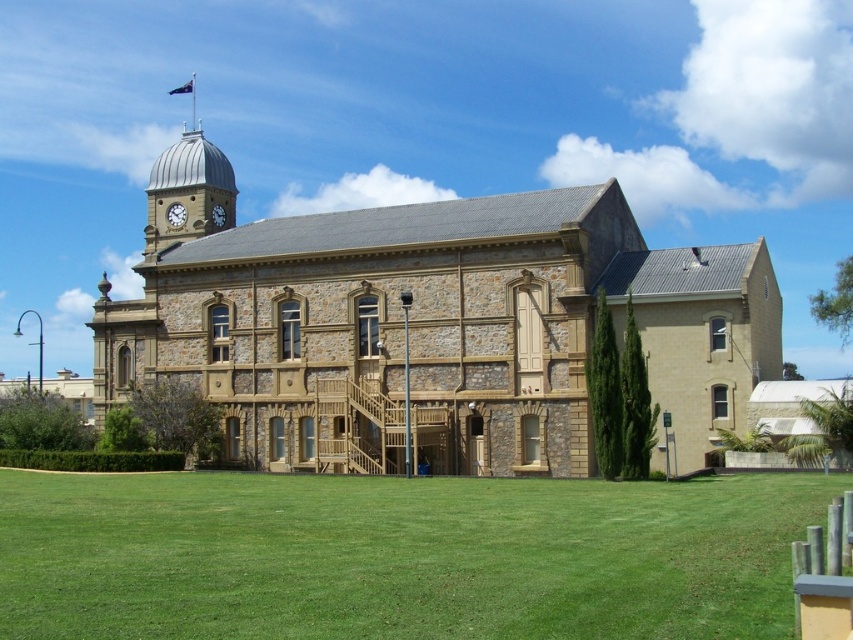
Between green grass at lower center and matte silver clock at upper left, which one is positioned higher?

matte silver clock at upper left is higher up.

Is point (54, 592) farther from viewer compared to point (178, 212)?

No, (54, 592) is in front of (178, 212).

Locate an element on the screen. green grass at lower center is located at coordinates (399, 556).